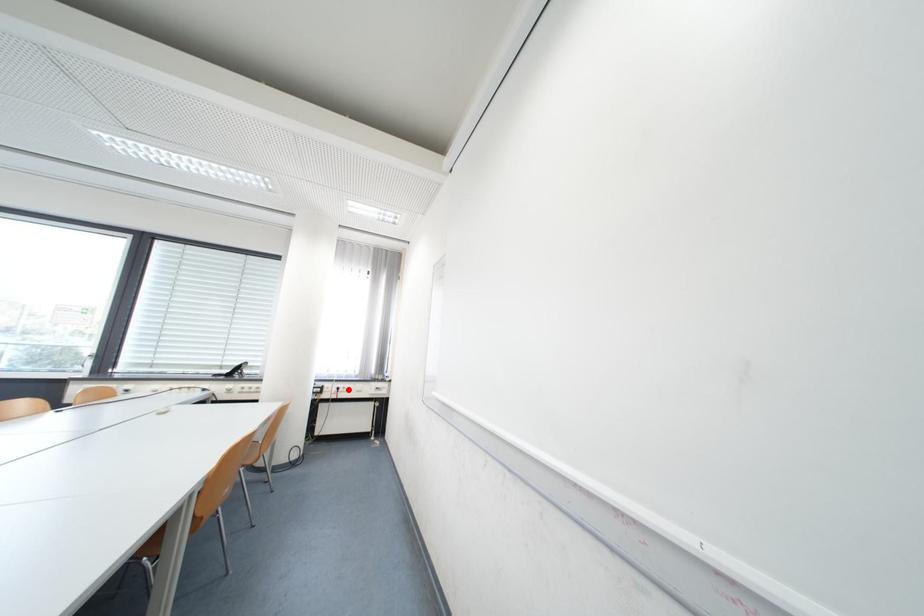
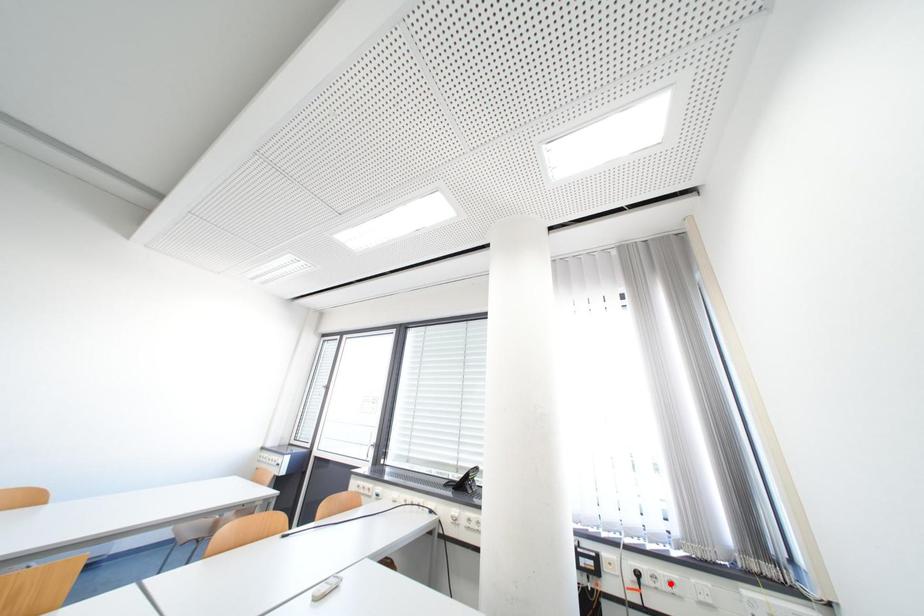
I am providing you with two images of the same scene from different viewpoints. A red point is marked on the first image and another point is marked on the second image. Is the red point in image1 aligned with the point shown in image2?

No